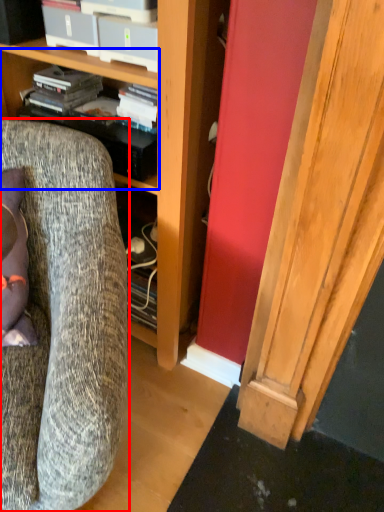
Question: Which point is closer to the camera, chair (highlighted by a red box) or shelf (highlighted by a blue box)?

Choices:
 (A) chair
 (B) shelf

Answer: (A)